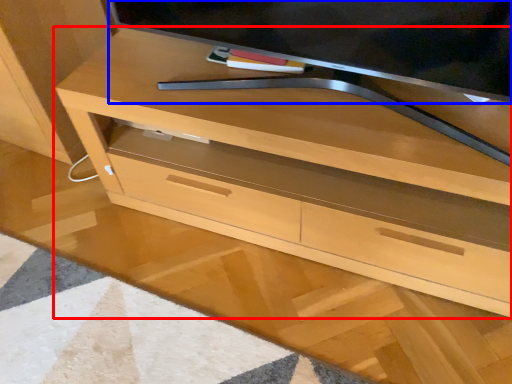
Question: Which object is further to the camera taking this photo, chest of drawers (highlighted by a red box) or television (highlighted by a blue box)?

Choices:
 (A) chest of drawers
 (B) television

Answer: (A)